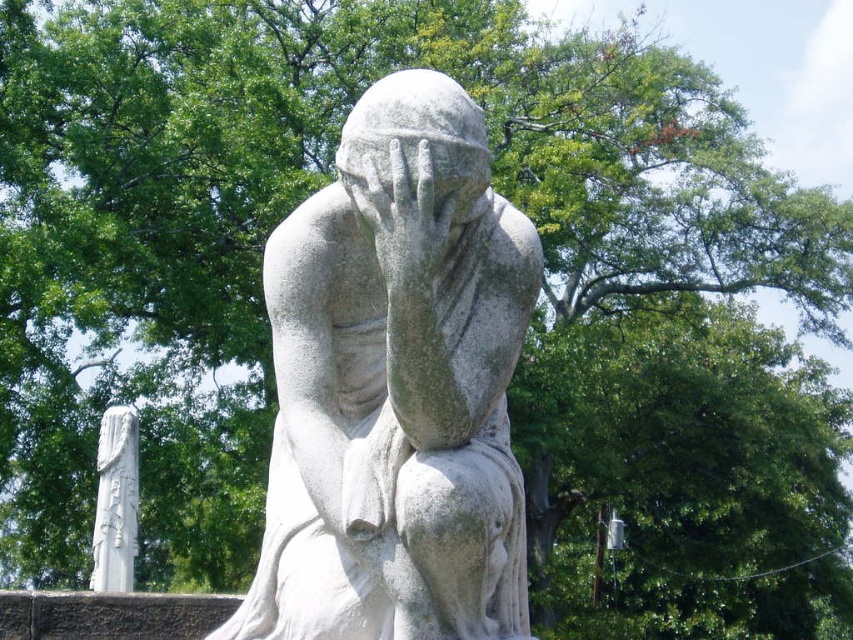
What do you see at coordinates (396, 387) in the screenshot? I see `white stone statue at center` at bounding box center [396, 387].

Is white stone statue at center taller than white stone column at left?

Yes.

Identify the location of white stone statue at center. (396, 387).

What are the coordinates of `white stone statue at center` in the screenshot? It's located at (396, 387).

Between smooth stone hand at center and white stone column at left, which one has less height?

smooth stone hand at center

Does smooth stone hand at center have a smaller size compared to white stone column at left?

Correct, smooth stone hand at center occupies less space than white stone column at left.

Who is more forward, (426, 273) or (107, 534)?

Point (426, 273)

Find the location of a particular element. smooth stone hand at center is located at coordinates (404, 211).

Can you confirm if white stone statue at center is positioned to the right of smooth stone hand at center?

Correct, you'll find white stone statue at center to the right of smooth stone hand at center.

Is the position of white stone statue at center less distant than that of smooth stone hand at center?

No, it is not.

Describe the element at coordinates (396, 387) in the screenshot. I see `white stone statue at center` at that location.

Where is `white stone statue at center`? This screenshot has height=640, width=853. white stone statue at center is located at coordinates (396, 387).